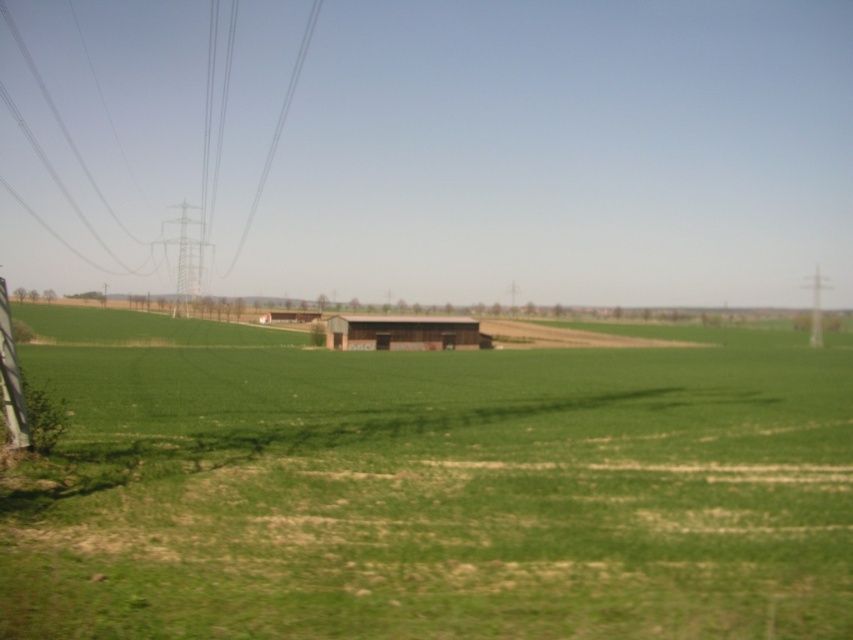
Who is higher up, green grassy field at center or metallic wire at left?

metallic wire at left is higher up.

Consider the image. Between green grassy field at center and metallic wire at left, which one appears on the right side from the viewer's perspective?

Positioned to the right is green grassy field at center.

Find the location of `green grassy field at center`. green grassy field at center is located at coordinates (431, 488).